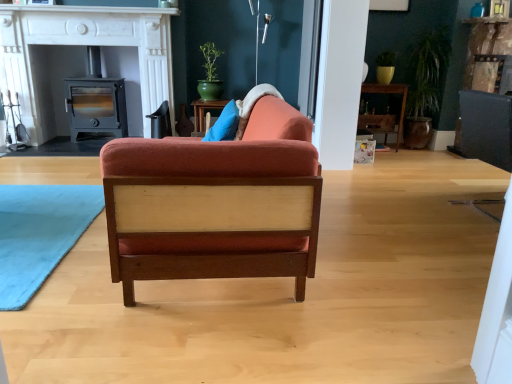
Question: Does wooden shelf at center have a lesser height compared to matte black wood stove at left?

Choices:
 (A) yes
 (B) no

Answer: (A)

Question: Does wooden shelf at center appear on the left side of matte black wood stove at left?

Choices:
 (A) yes
 (B) no

Answer: (B)

Question: From a real-world perspective, is wooden shelf at center below matte black wood stove at left?

Choices:
 (A) no
 (B) yes

Answer: (B)

Question: Is wooden shelf at center aimed at matte black wood stove at left?

Choices:
 (A) no
 (B) yes

Answer: (A)

Question: Can you confirm if wooden shelf at center is wider than matte black wood stove at left?

Choices:
 (A) no
 (B) yes

Answer: (A)

Question: Is velvet orange chair at center inside the boundaries of matte black wood-burning stove at left, or outside?

Choices:
 (A) inside
 (B) outside

Answer: (B)

Question: Is velvet orange chair at center in front of or behind matte black wood-burning stove at left in the image?

Choices:
 (A) behind
 (B) front

Answer: (B)

Question: From a real-world perspective, is velvet orange chair at center above or below matte black wood-burning stove at left?

Choices:
 (A) above
 (B) below

Answer: (B)

Question: Does point (290, 195) appear closer or farther from the camera than point (76, 125)?

Choices:
 (A) closer
 (B) farther

Answer: (A)

Question: From a real-world perspective, is velvet orange chair at center positioned above or below matte black wood stove at left?

Choices:
 (A) above
 (B) below

Answer: (B)

Question: Considering their positions, is velvet orange chair at center located in front of or behind matte black wood stove at left?

Choices:
 (A) behind
 (B) front

Answer: (B)

Question: Is velvet orange chair at center to the left or to the right of matte black wood stove at left in the image?

Choices:
 (A) right
 (B) left

Answer: (A)

Question: Considering the positions of point (189, 243) and point (142, 16), is point (189, 243) closer or farther from the camera than point (142, 16)?

Choices:
 (A) closer
 (B) farther

Answer: (A)

Question: In terms of height, does velvet orange chair at center look taller or shorter compared to wooden shelf at center?

Choices:
 (A) tall
 (B) short

Answer: (A)

Question: Is velvet orange chair at center inside or outside of wooden shelf at center?

Choices:
 (A) inside
 (B) outside

Answer: (B)